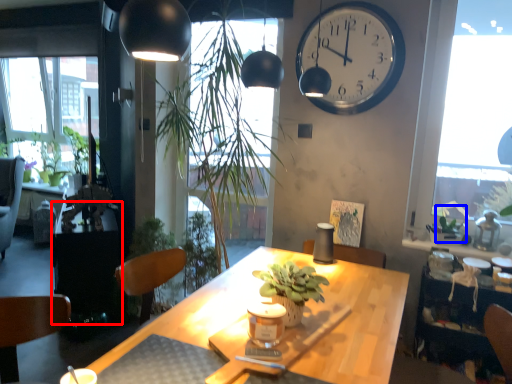
Question: Which object appears farthest to the camera in this image, table (highlighted by a red box) or plant (highlighted by a blue box)?

Choices:
 (A) table
 (B) plant

Answer: (A)